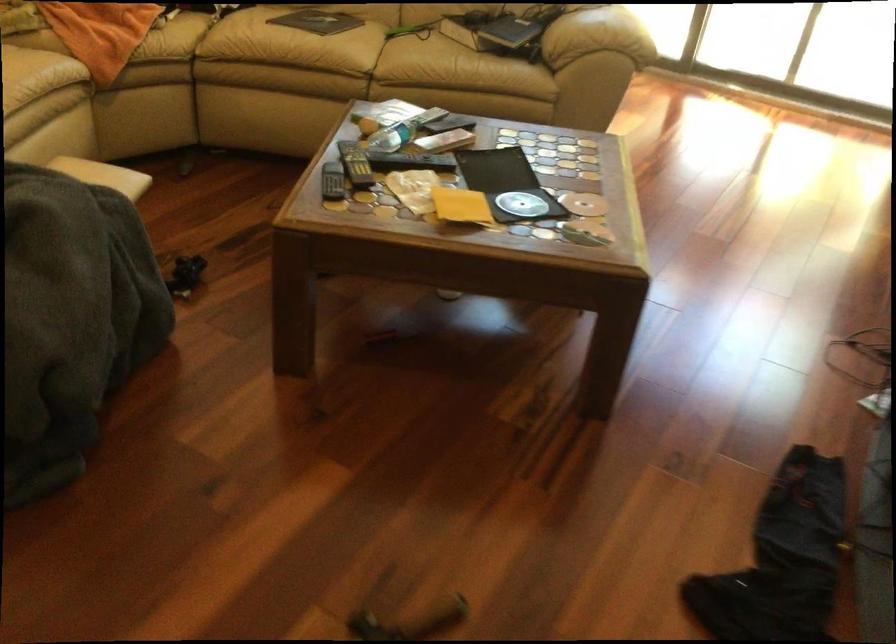
Identify the location of sofa armrest. [597, 35].